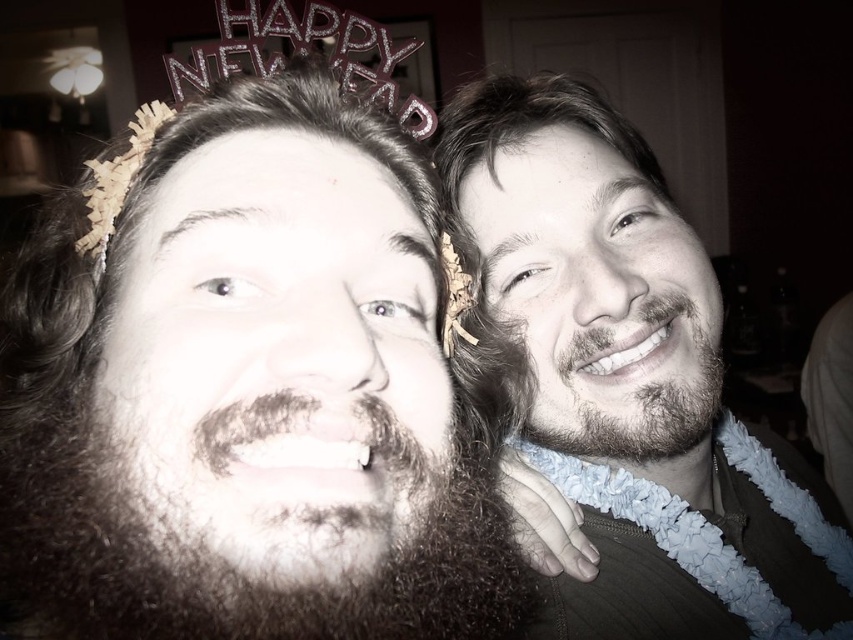
Question: Is dark brown fuzzy beard at lower left to the right of wooden beads at left from the viewer's perspective?

Choices:
 (A) yes
 (B) no

Answer: (A)

Question: Which object appears closest to the camera in this image?

Choices:
 (A) beige fabric lei at right
 (B) dark brown fuzzy beard at lower left

Answer: (B)

Question: Which of the following is the closest to the observer?

Choices:
 (A) (335, 596)
 (B) (486, 218)
 (C) (705, 385)
 (D) (457, 102)

Answer: (A)

Question: Observing the image, what is the correct spatial positioning of dark brown fuzzy beard at lower left in reference to sparkly silver crown at upper center?

Choices:
 (A) above
 (B) below

Answer: (B)

Question: Is dark brown fuzzy beard at lower left to the right of sparkly silver crown at upper center from the viewer's perspective?

Choices:
 (A) no
 (B) yes

Answer: (B)

Question: Which point is farther from the camera taking this photo?

Choices:
 (A) (695, 611)
 (B) (102, 228)
 (C) (154, 625)
 (D) (370, 96)

Answer: (A)